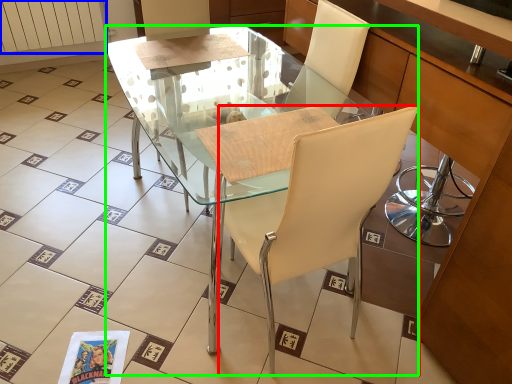
Question: Which is farther away from chair (highlighted by a red box)? radiator (highlighted by a blue box) or desk (highlighted by a green box)?

Choices:
 (A) radiator
 (B) desk

Answer: (A)